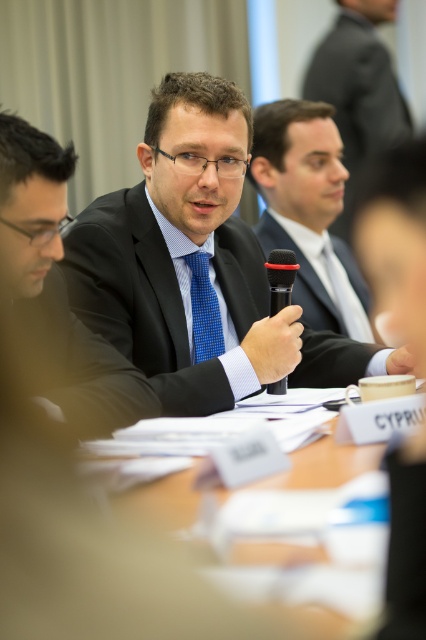
You are a guest speaker at a conference and need to place your nameplate on the wooden table at center. Your nameplate is 15 cm tall. Will it fit under the blue checkered tie at center?

The wooden table at center is not as tall as blue checkered tie at center, so the nameplate will fit under the blue checkered tie at center since it is shorter than the tie.

You are organizing a conference and need to ensure that the microphone fits on a stand that can only accommodate items narrower than the dark gray suit at upper right. Can the matte black microphone at center be placed on the stand?

The matte black microphone at center is narrower than the dark gray suit at upper right, so it can be placed on the stand.